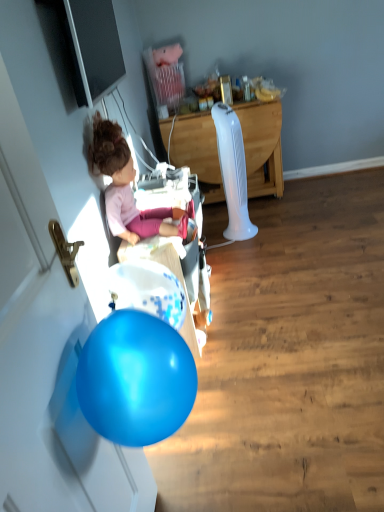
Question: From the image's perspective, is white plastic fan at center on top of matte pink doll at left?

Choices:
 (A) yes
 (B) no

Answer: (A)

Question: Can you confirm if white plastic fan at center is shorter than matte pink doll at left?

Choices:
 (A) yes
 (B) no

Answer: (B)

Question: Considering the relative sizes of white plastic fan at center and matte pink doll at left in the image provided, is white plastic fan at center thinner than matte pink doll at left?

Choices:
 (A) yes
 (B) no

Answer: (B)

Question: Is white plastic fan at center next to matte pink doll at left and touching it?

Choices:
 (A) no
 (B) yes

Answer: (A)

Question: Can you confirm if white plastic fan at center is taller than matte pink doll at left?

Choices:
 (A) no
 (B) yes

Answer: (B)

Question: From the image's perspective, is white plastic fan at center below matte pink doll at left?

Choices:
 (A) yes
 (B) no

Answer: (B)

Question: From a real-world perspective, is matte pink doll at left located beneath white plastic fan at center?

Choices:
 (A) no
 (B) yes

Answer: (A)

Question: Is white plastic fan at center a part of matte pink doll at left?

Choices:
 (A) no
 (B) yes

Answer: (A)

Question: Are matte pink doll at left and white plastic fan at center far apart?

Choices:
 (A) no
 (B) yes

Answer: (B)

Question: Can you confirm if matte pink doll at left is positioned to the right of white plastic fan at center?

Choices:
 (A) yes
 (B) no

Answer: (B)

Question: Is matte pink doll at left positioned in front of white plastic fan at center?

Choices:
 (A) no
 (B) yes

Answer: (B)

Question: Can you confirm if matte pink doll at left is wider than white plastic fan at center?

Choices:
 (A) no
 (B) yes

Answer: (A)

Question: From a real-world perspective, is matte pink doll at left above or below white plastic fan at center?

Choices:
 (A) below
 (B) above

Answer: (B)